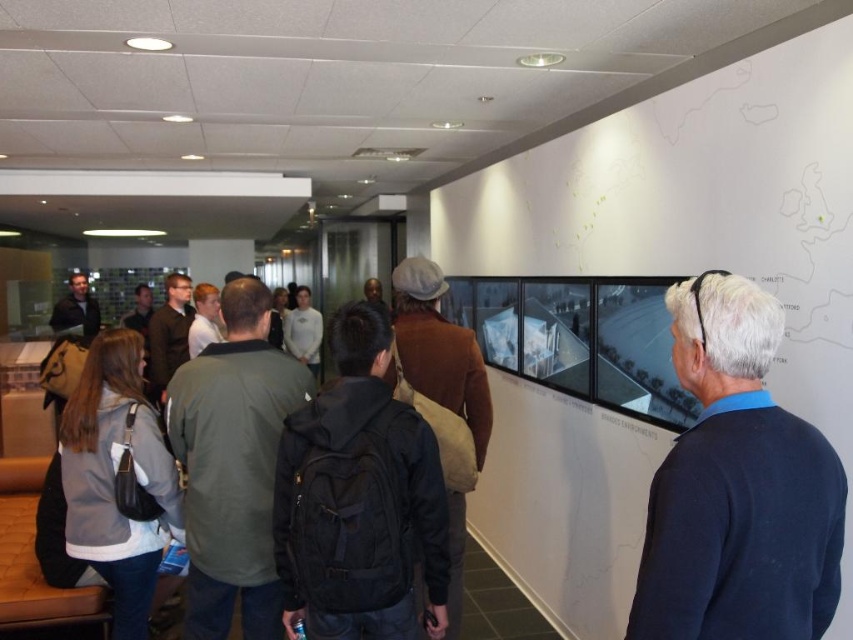
Does dark blue sweater at center appear under brown woolen coat at center?

No, dark blue sweater at center is not below brown woolen coat at center.

Who is more distant from viewer, (753, 492) or (456, 342)?

The point (456, 342) is behind.

The width and height of the screenshot is (853, 640). I want to click on dark blue sweater at center, so click(x=737, y=486).

This screenshot has width=853, height=640. In order to click on dark blue sweater at center in this screenshot , I will do `click(737, 486)`.